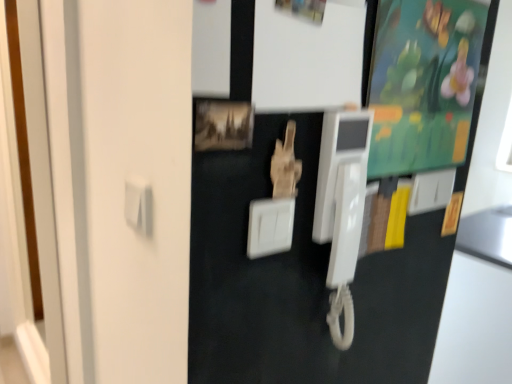
Question: Is point (432, 183) closer or farther from the camera than point (249, 235)?

Choices:
 (A) farther
 (B) closer

Answer: (A)

Question: In the image, is white plastic light switch at upper right, the second light switch viewed from the front, on the left side or the right side of white plastic light switch at center, the 2th light switch viewed from the back?

Choices:
 (A) left
 (B) right

Answer: (B)

Question: Which is nearer to the white plastic light switch at center, the 2th light switch viewed from the back?

Choices:
 (A) wooden photo frame at center
 (B) green matte bulletin board at upper right
 (C) white plastic light switch at upper right, the second light switch viewed from the front
 (D) white plastic payphone at center

Answer: (A)

Question: Which object is positioned closest to the wooden photo frame at center?

Choices:
 (A) white plastic light switch at upper right, the second light switch viewed from the front
 (B) green matte bulletin board at upper right
 (C) white plastic light switch at center, acting as the 2th light switch starting from the right
 (D) white plastic payphone at center

Answer: (C)